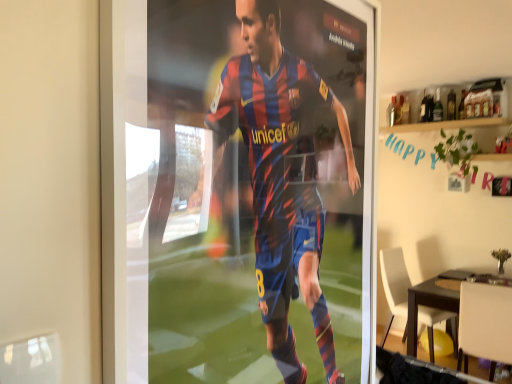
Question: Is white plastic chair at lower right, arranged as the first chair when viewed from the back, far from dark brown wooden table at lower right?

Choices:
 (A) yes
 (B) no

Answer: (B)

Question: Is white plastic chair at lower right, the 2th chair from the front, not within dark brown wooden table at lower right?

Choices:
 (A) yes
 (B) no

Answer: (A)

Question: Is white plastic chair at lower right, arranged as the first chair when viewed from the back, further to the viewer compared to dark brown wooden table at lower right?

Choices:
 (A) yes
 (B) no

Answer: (A)

Question: From a real-world perspective, is white plastic chair at lower right, the 2th chair from the front, over dark brown wooden table at lower right?

Choices:
 (A) yes
 (B) no

Answer: (A)

Question: Is white plastic chair at lower right, arranged as the first chair when viewed from the back, shorter than dark brown wooden table at lower right?

Choices:
 (A) yes
 (B) no

Answer: (B)

Question: Is dark brown wooden table at lower right completely or partially inside white plastic chair at lower right, the 2th chair from the front?

Choices:
 (A) yes
 (B) no

Answer: (B)

Question: Considering the relative sizes of dark brown wooden table at lower right and white matte chair at lower right, which appears as the first chair when viewed from the front, in the image provided, is dark brown wooden table at lower right smaller than white matte chair at lower right, which appears as the first chair when viewed from the front,?

Choices:
 (A) yes
 (B) no

Answer: (B)

Question: Is dark brown wooden table at lower right outside of white matte chair at lower right, which ranks as the 2th chair in back-to-front order?

Choices:
 (A) no
 (B) yes

Answer: (B)

Question: Is dark brown wooden table at lower right thinner than white matte chair at lower right, which appears as the first chair when viewed from the front?

Choices:
 (A) no
 (B) yes

Answer: (A)

Question: Does dark brown wooden table at lower right come behind white matte chair at lower right, which ranks as the 2th chair in back-to-front order?

Choices:
 (A) no
 (B) yes

Answer: (B)

Question: Is the depth of dark brown wooden table at lower right less than that of white matte chair at lower right, which appears as the first chair when viewed from the front?

Choices:
 (A) yes
 (B) no

Answer: (B)

Question: Is dark brown wooden table at lower right positioned with its back to white matte chair at lower right, which appears as the first chair when viewed from the front?

Choices:
 (A) yes
 (B) no

Answer: (B)

Question: Is the position of white matte chair at lower right, which appears as the first chair when viewed from the front, more distant than that of white plastic chair at lower right, arranged as the first chair when viewed from the back?

Choices:
 (A) yes
 (B) no

Answer: (B)